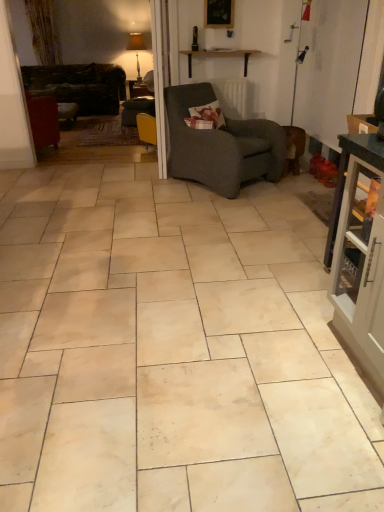
I want to click on floral fabric pillow at center, so click(x=209, y=113).

The height and width of the screenshot is (512, 384). What do you see at coordinates (361, 265) in the screenshot? I see `matte gray cabinet at right` at bounding box center [361, 265].

Measure the distance between dark gray textured armchair at center and camera.

dark gray textured armchair at center and camera are 11.68 feet apart.

What is the approximate height of beige marble tile at center?

3.87 inches.

What is the approximate height of matte white lampshade at upper center?

matte white lampshade at upper center is 35.61 inches tall.

Locate an element on the screen. This screenshot has width=384, height=512. floral fabric pillow at center is located at coordinates (209, 113).

In the scene shown: From a real-world perspective, is dark gray textured armchair at center physically located above or below dark brown leather couch at left?

In terms of real-world spatial position, dark gray textured armchair at center is above dark brown leather couch at left.

Is dark gray textured armchair at center further to the viewer compared to dark brown leather couch at left?

That is False.

Who is bigger, dark gray textured armchair at center or dark brown leather couch at left?

Bigger between the two is dark brown leather couch at left.

From a real-world perspective, is dark brown leather couch at left physically located above or below beige marble tile at center?

From a real-world perspective, dark brown leather couch at left is physically above beige marble tile at center.

Can you see dark brown leather couch at left touching beige marble tile at center?

No.

Is dark brown leather couch at left completely or partially outside of beige marble tile at center?

Yes, dark brown leather couch at left is outside of beige marble tile at center.

Looking at this image, can you confirm if dark brown leather couch at left is smaller than beige marble tile at center?

Incorrect, dark brown leather couch at left is not smaller in size than beige marble tile at center.

Between beige marble tile at center and dark gray textured armchair at center, which one is positioned in front?

beige marble tile at center.

Is the surface of beige marble tile at center in direct contact with dark gray textured armchair at center?

No, beige marble tile at center is not touching dark gray textured armchair at center.

Which object is positioned more to the right, beige marble tile at center or dark gray textured armchair at center?

dark gray textured armchair at center is more to the right.

The width and height of the screenshot is (384, 512). Find the location of `cabinetry that appears above the beige marble tile at center (from a real-world perspective)`. cabinetry that appears above the beige marble tile at center (from a real-world perspective) is located at coordinates (361, 265).

From the image's perspective, is matte gray cabinet at right above or below beige marble tile at center?

Clearly, from the image's perspective, matte gray cabinet at right is below beige marble tile at center.

Is matte gray cabinet at right positioned with its back to beige marble tile at center?

matte gray cabinet at right is not turned away from beige marble tile at center.

Can you confirm if matte gray cabinet at right is smaller than beige marble tile at center?

Yes.

Would you consider dark brown leather couch at left to be distant from matte white lampshade at upper center?

Yes.

Which is closer, [31,92] or [139,83]?

The point [31,92] is more forward.

From the image's perspective, is dark brown leather couch at left on top of matte white lampshade at upper center?

Incorrect, from the image's perspective, dark brown leather couch at left is lower than matte white lampshade at upper center.

Which is behind, point (194, 110) or point (206, 12)?

The point (206, 12) is more distant.

Is floral fabric pillow at center aimed at wooden picture frame at upper center?

No, floral fabric pillow at center is not turned towards wooden picture frame at upper center.

This screenshot has width=384, height=512. Find the location of `picture frame above the floral fabric pillow at center (from a real-world perspective)`. picture frame above the floral fabric pillow at center (from a real-world perspective) is located at coordinates (219, 13).

From a real-world perspective, is floral fabric pillow at center on wooden picture frame at upper center?

Incorrect, from a real-world perspective, floral fabric pillow at center is lower than wooden picture frame at upper center.

Would you say dark gray textured armchair at center is outside floral fabric pillow at center?

Yes, dark gray textured armchair at center is outside of floral fabric pillow at center.

Is dark gray textured armchair at center looking in the opposite direction of floral fabric pillow at center?

Absolutely, dark gray textured armchair at center is directed away from floral fabric pillow at center.

Is dark gray textured armchair at center taller or shorter than floral fabric pillow at center?

dark gray textured armchair at center is taller than floral fabric pillow at center.

The height and width of the screenshot is (512, 384). Find the location of `studio couch behind the dark gray textured armchair at center`. studio couch behind the dark gray textured armchair at center is located at coordinates (79, 85).

Where is `studio couch above the beige marble tile at center (from a real-world perspective)`? studio couch above the beige marble tile at center (from a real-world perspective) is located at coordinates (79, 85).

Based on their spatial positions, is beige marble tile at center or matte white lampshade at upper center further from floral fabric pillow at center?

Among the two, matte white lampshade at upper center is located further to floral fabric pillow at center.

Considering their positions, is floral fabric pillow at center positioned further to dark gray textured armchair at center than wooden picture frame at upper center?

The object further to dark gray textured armchair at center is wooden picture frame at upper center.

Considering their positions, is matte gray cabinet at right positioned closer to dark gray textured armchair at center than matte white lampshade at upper center?

The object closer to dark gray textured armchair at center is matte gray cabinet at right.

From the image, which object appears to be nearer to matte gray cabinet at right, matte white lampshade at upper center or wooden picture frame at upper center?

wooden picture frame at upper center lies closer to matte gray cabinet at right than the other object.

Considering their positions, is wooden picture frame at upper center positioned further to dark brown leather couch at left than matte gray cabinet at right?

matte gray cabinet at right lies further to dark brown leather couch at left than the other object.

Based on their spatial positions, is dark brown leather couch at left or wooden picture frame at upper center further from matte white lampshade at upper center?

wooden picture frame at upper center is positioned further to the anchor matte white lampshade at upper center.

Based on their spatial positions, is floral fabric pillow at center or beige marble tile at center closer to dark brown leather couch at left?

floral fabric pillow at center.

Based on their spatial positions, is wooden picture frame at upper center or beige marble tile at center closer to floral fabric pillow at center?

The object closer to floral fabric pillow at center is wooden picture frame at upper center.

Where is `picture frame located between dark gray textured armchair at center and dark brown leather couch at left in the depth direction`? picture frame located between dark gray textured armchair at center and dark brown leather couch at left in the depth direction is located at coordinates (219, 13).

You are a GUI agent. You are given a task and a screenshot of the screen. Output one action in this format:
    pyautogui.click(x=<x>, y=<y>)
    Task: Click on the chair between beige marble tile at center and floral fabric pillow at center in the front-back direction
    The image size is (384, 512).
    Given the screenshot: What is the action you would take?
    tap(220, 145)

Find the location of a particular element. picture frame located between floral fabric pillow at center and matte white lampshade at upper center in the depth direction is located at coordinates (219, 13).

I want to click on pillow between dark gray textured armchair at center and matte white lampshade at upper center along the z-axis, so click(209, 113).